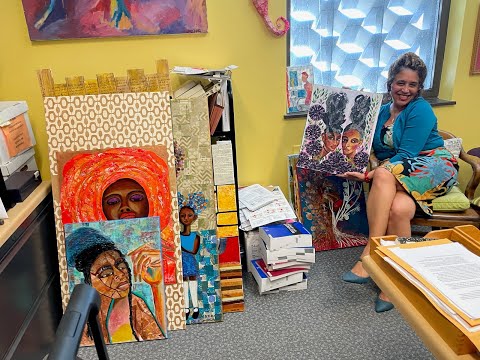
Locate an element on the screen. The height and width of the screenshot is (360, 480). stack of papers is located at coordinates (435, 278).